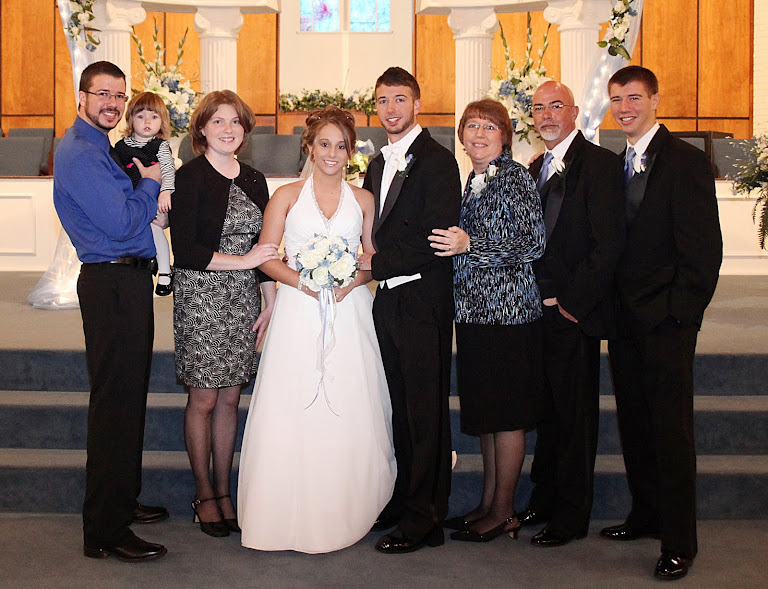
At what (x,y) coordinates should I click in order to perform the action: click on flower bouquet. Please return your answer as a coordinate pair (x, y). Image resolution: width=768 pixels, height=589 pixels. Looking at the image, I should click on (328, 260).